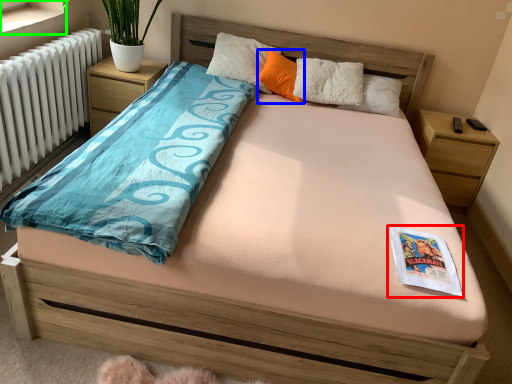
Question: Which is farther away from magazine (highlighted by a red box)? pillow (highlighted by a blue box) or window sill (highlighted by a green box)?

Choices:
 (A) pillow
 (B) window sill

Answer: (B)